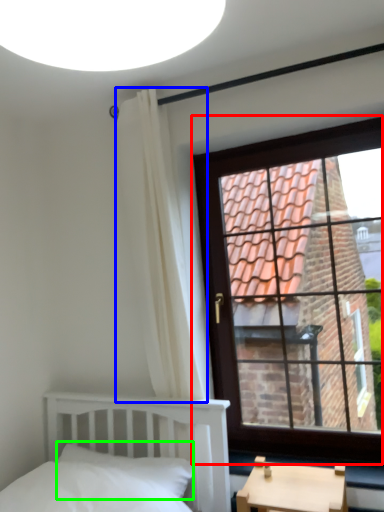
Question: Based on their relative distances, which object is farther from window (highlighted by a red box)? Choose from curtain (highlighted by a blue box) and pillow (highlighted by a green box).

Choices:
 (A) curtain
 (B) pillow

Answer: (B)